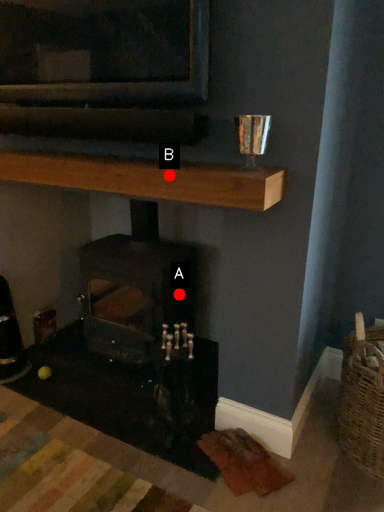
Question: Two points are circled on the image, labeled by A and B beside each circle. Which point appears farthest from the camera in this image?

Choices:
 (A) A is further
 (B) B is further

Answer: (A)